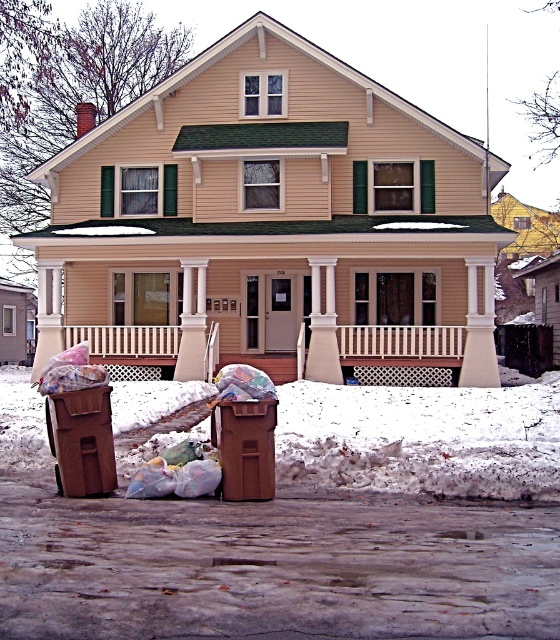
Question: Does white fluffy snow at lower center have a lesser width compared to translucent plastic bags at lower center?

Choices:
 (A) no
 (B) yes

Answer: (A)

Question: Which of these objects is positioned closest to the translucent plastic bags at lower left?

Choices:
 (A) white fluffy snow at lower center
 (B) white wood column at center

Answer: (B)

Question: Does white fluffy snow at lower center have a larger size compared to translucent plastic bags at lower left?

Choices:
 (A) no
 (B) yes

Answer: (B)

Question: Can you confirm if white fluffy snow at lower center is positioned to the right of translucent plastic bags at lower left?

Choices:
 (A) yes
 (B) no

Answer: (A)

Question: Which object appears farthest from the camera in this image?

Choices:
 (A) white fluffy snow at lower center
 (B) translucent plastic bags at lower left

Answer: (A)

Question: Based on their relative distances, which object is nearer to the translucent plastic bags at lower left?

Choices:
 (A) translucent plastic bags at lower center
 (B) white wood column at center
 (C) white fluffy snow at lower center

Answer: (A)